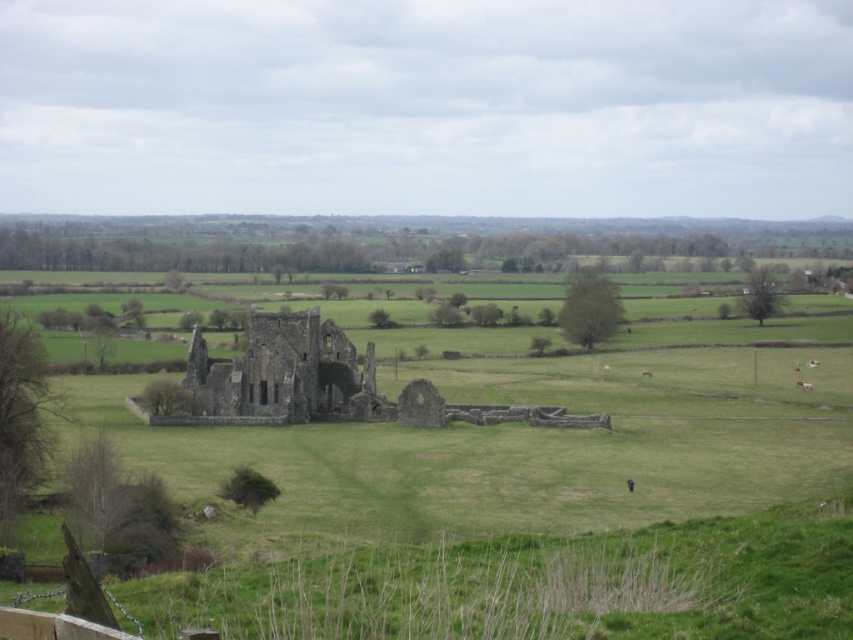
You are a photographer standing in the field and want to capture both the brown stone ruins at center and the brown furry cow at lower right in the same frame. Which object should you focus on first to ensure both are in focus?

You should focus on the brown stone ruins at center first because it is closer to you than the brown furry cow at lower right. By focusing on the closer object, the farther object will also be in focus due to the depth of field.

You are a photographer planning to capture a landscape shot of the green grassy field at center and the brown stone ruins at center. Which object will appear taller in your photo?

The green grassy field at center has a greater height compared to the brown stone ruins at center, so it will appear taller in the photo.